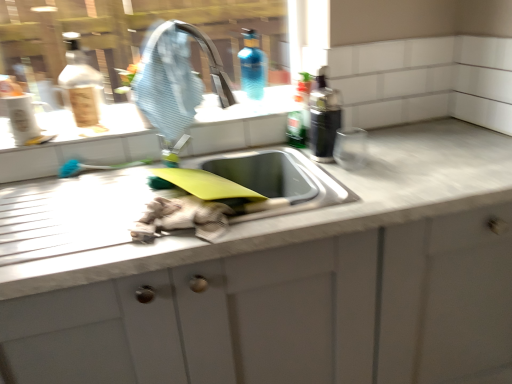
Image resolution: width=512 pixels, height=384 pixels. What do you see at coordinates (246, 107) in the screenshot? I see `white glossy sink at upper center` at bounding box center [246, 107].

Where is `green glass bottle at upper right, which is counted as the 2th bottle, starting from the left`? This screenshot has width=512, height=384. green glass bottle at upper right, which is counted as the 2th bottle, starting from the left is located at coordinates coord(297,128).

How much space does green glass bottle at upper right, which is counted as the 2th bottle, starting from the left, occupy vertically?

green glass bottle at upper right, which is counted as the 2th bottle, starting from the left, is 7.54 inches tall.

How much space does black plastic bottle at upper right, marked as the 3th bottle in a left-to-right arrangement, occupy horizontally?

black plastic bottle at upper right, marked as the 3th bottle in a left-to-right arrangement, is 4.48 inches wide.

Where is `white glossy sink at upper center`? Image resolution: width=512 pixels, height=384 pixels. white glossy sink at upper center is located at coordinates (246, 107).

How distant is white glossy sink at upper center from blue rubber tap at upper center?

8.62 inches.

Is white glossy sink at upper center further to camera compared to blue rubber tap at upper center?

That is True.

From a real-world perspective, is white glossy sink at upper center positioned above or below blue rubber tap at upper center?

From a real-world perspective, white glossy sink at upper center is physically below blue rubber tap at upper center.

Can you confirm if blue glass bottle at upper center, which is the first bottle in left-to-right order, is bigger than black plastic bottle at upper right, marked as the 3th bottle in a left-to-right arrangement?

Yes, blue glass bottle at upper center, which is the first bottle in left-to-right order, is bigger than black plastic bottle at upper right, marked as the 3th bottle in a left-to-right arrangement.

How different are the orientations of blue glass bottle at upper center, which is the first bottle in left-to-right order, and black plastic bottle at upper right, marked as the 3th bottle in a left-to-right arrangement, in degrees?

3.24 degrees separate the facing orientations of blue glass bottle at upper center, which is the first bottle in left-to-right order, and black plastic bottle at upper right, marked as the 3th bottle in a left-to-right arrangement.

Which is behind, point (250, 51) or point (335, 103)?

The point (250, 51) is farther from the camera.

Is the position of blue glass bottle at upper center, arranged as the third bottle when viewed from the right, less distant than that of black plastic bottle at upper right, marked as the 3th bottle in a left-to-right arrangement?

That is False.

Can you tell me how much green glass bottle at upper right, which is counted as the 2th bottle, starting from the left, and transparent glass window at upper center differ in facing direction?

They differ by 26.3 degrees in their facing directions.

Where is `window in front of the green glass bottle at upper right, which is counted as the 2th bottle, starting from the left`? window in front of the green glass bottle at upper right, which is counted as the 2th bottle, starting from the left is located at coordinates (136, 34).

Is green glass bottle at upper right, which is counted as the 2th bottle, starting from the left, not within transparent glass window at upper center?

Absolutely, green glass bottle at upper right, which is counted as the 2th bottle, starting from the left, is external to transparent glass window at upper center.

Between green glass bottle at upper right, marked as the 2th bottle in a right-to-left arrangement, and transparent glass window at upper center, which one appears on the right side from the viewer's perspective?

Positioned to the right is green glass bottle at upper right, marked as the 2th bottle in a right-to-left arrangement.

Considering the sizes of transparent glass window at upper center and blue rubber tap at upper center in the image, is transparent glass window at upper center wider or thinner than blue rubber tap at upper center?

In the image, transparent glass window at upper center appears to be more narrow than blue rubber tap at upper center.

How different are the orientations of transparent glass window at upper center and blue rubber tap at upper center in degrees?

There is a 35.4-degree angle between the facing directions of transparent glass window at upper center and blue rubber tap at upper center.

Considering the sizes of objects transparent glass window at upper center and blue rubber tap at upper center in the image provided, who is smaller, transparent glass window at upper center or blue rubber tap at upper center?

blue rubber tap at upper center is smaller.

Is transparent glass window at upper center directly adjacent to blue rubber tap at upper center?

No, transparent glass window at upper center is not beside blue rubber tap at upper center.

Who is bigger, transparent glass window at upper center or blue glass bottle at upper center, arranged as the third bottle when viewed from the right?

transparent glass window at upper center is bigger.

Is transparent glass window at upper center wider than blue glass bottle at upper center, which is the first bottle in left-to-right order?

In fact, transparent glass window at upper center might be narrower than blue glass bottle at upper center, which is the first bottle in left-to-right order.

Is the depth of transparent glass window at upper center less than that of blue glass bottle at upper center, arranged as the third bottle when viewed from the right?

Yes, it is.

Which point is more forward, (126, 43) or (251, 95)?

Point (126, 43)

Is green glass bottle at upper right, marked as the 2th bottle in a right-to-left arrangement, facing away from blue glass bottle at upper center, which is the first bottle in left-to-right order?

green glass bottle at upper right, marked as the 2th bottle in a right-to-left arrangement, does not have its back to blue glass bottle at upper center, which is the first bottle in left-to-right order.

What's the angular difference between green glass bottle at upper right, marked as the 2th bottle in a right-to-left arrangement, and blue glass bottle at upper center, arranged as the third bottle when viewed from the right,'s facing directions?

The facing directions of green glass bottle at upper right, marked as the 2th bottle in a right-to-left arrangement, and blue glass bottle at upper center, arranged as the third bottle when viewed from the right, are 26.7 degrees apart.

How distant is green glass bottle at upper right, marked as the 2th bottle in a right-to-left arrangement, from blue glass bottle at upper center, arranged as the third bottle when viewed from the right?

green glass bottle at upper right, marked as the 2th bottle in a right-to-left arrangement, and blue glass bottle at upper center, arranged as the third bottle when viewed from the right, are 38.68 inches apart.

Does green glass bottle at upper right, marked as the 2th bottle in a right-to-left arrangement, have a greater height compared to blue glass bottle at upper center, which is the first bottle in left-to-right order?

No.

Can you confirm if blue glass bottle at upper center, which is the first bottle in left-to-right order, is thinner than green glass bottle at upper right, marked as the 2th bottle in a right-to-left arrangement?

No.

From the image's perspective, between blue glass bottle at upper center, which is the first bottle in left-to-right order, and green glass bottle at upper right, marked as the 2th bottle in a right-to-left arrangement, who is located below?

green glass bottle at upper right, marked as the 2th bottle in a right-to-left arrangement, from the image's perspective.

Is point (263, 74) farther from viewer compared to point (309, 94)?

Yes, it is behind point (309, 94).

Locate an element on the screen. The width and height of the screenshot is (512, 384). tap on the right of white glossy sink at upper center is located at coordinates (203, 50).

The image size is (512, 384). Identify the location of the 2nd bottle behind when counting from the black plastic bottle at upper right, marked as the 3th bottle in a left-to-right arrangement. (253, 66).

Estimate the real-world distances between objects in this image. Which object is further from white glossy sink at upper center, white marble countertop at center or blue rubber tap at upper center?

Based on the image, white marble countertop at center appears to be further to white glossy sink at upper center.

Estimate the real-world distances between objects in this image. Which object is further from white glossy sink at upper center, black plastic bottle at upper right, marked as the 3th bottle in a left-to-right arrangement, or blue rubber tap at upper center?

black plastic bottle at upper right, marked as the 3th bottle in a left-to-right arrangement, lies further to white glossy sink at upper center than the other object.

From the picture: Estimate the real-world distances between objects in this image. Which object is further from white marble countertop at center, blue glass bottle at upper center, arranged as the third bottle when viewed from the right, or black plastic bottle at upper right, marked as the 3th bottle in a left-to-right arrangement?

The object further to white marble countertop at center is blue glass bottle at upper center, arranged as the third bottle when viewed from the right.

Based on their spatial positions, is green glass bottle at upper right, which is counted as the 2th bottle, starting from the left, or black plastic bottle at upper right, which appears as the first bottle when viewed from the right, further from white marble countertop at center?

green glass bottle at upper right, which is counted as the 2th bottle, starting from the left, lies further to white marble countertop at center than the other object.

Looking at the image, which one is located further to green glass bottle at upper right, which is counted as the 2th bottle, starting from the left, white glossy sink at upper center or blue glass bottle at upper center, which is the first bottle in left-to-right order?

blue glass bottle at upper center, which is the first bottle in left-to-right order, lies further to green glass bottle at upper right, which is counted as the 2th bottle, starting from the left, than the other object.

Looking at the image, which one is located further to blue glass bottle at upper center, arranged as the third bottle when viewed from the right, blue rubber tap at upper center or white marble countertop at center?

white marble countertop at center is positioned further to the anchor blue glass bottle at upper center, arranged as the third bottle when viewed from the right.

Consider the image. From the image, which object appears to be nearer to transparent glass window at upper center, white marble countertop at center or green glass bottle at upper right, which is counted as the 2th bottle, starting from the left?

green glass bottle at upper right, which is counted as the 2th bottle, starting from the left, is closer to transparent glass window at upper center.

Estimate the real-world distances between objects in this image. Which object is further from blue rubber tap at upper center, transparent glass window at upper center or white glossy sink at upper center?

transparent glass window at upper center is positioned further to the anchor blue rubber tap at upper center.

Where is `window sill between transparent glass window at upper center and black plastic bottle at upper right, marked as the 3th bottle in a left-to-right arrangement, from left to right`? The height and width of the screenshot is (384, 512). window sill between transparent glass window at upper center and black plastic bottle at upper right, marked as the 3th bottle in a left-to-right arrangement, from left to right is located at coordinates (246, 107).

You are a GUI agent. You are given a task and a screenshot of the screen. Output one action in this format:
    pyautogui.click(x=<x>, y=<y>)
    Task: Click on the window sill between transparent glass window at upper center and white marble countertop at center in the up-down direction
    The width and height of the screenshot is (512, 384).
    Given the screenshot: What is the action you would take?
    pyautogui.click(x=246, y=107)

The image size is (512, 384). I want to click on bottle situated between white glossy sink at upper center and green glass bottle at upper right, which is counted as the 2th bottle, starting from the left, from left to right, so click(x=253, y=66).

The height and width of the screenshot is (384, 512). I want to click on tap located between transparent glass window at upper center and black plastic bottle at upper right, marked as the 3th bottle in a left-to-right arrangement, in the left-right direction, so click(x=203, y=50).